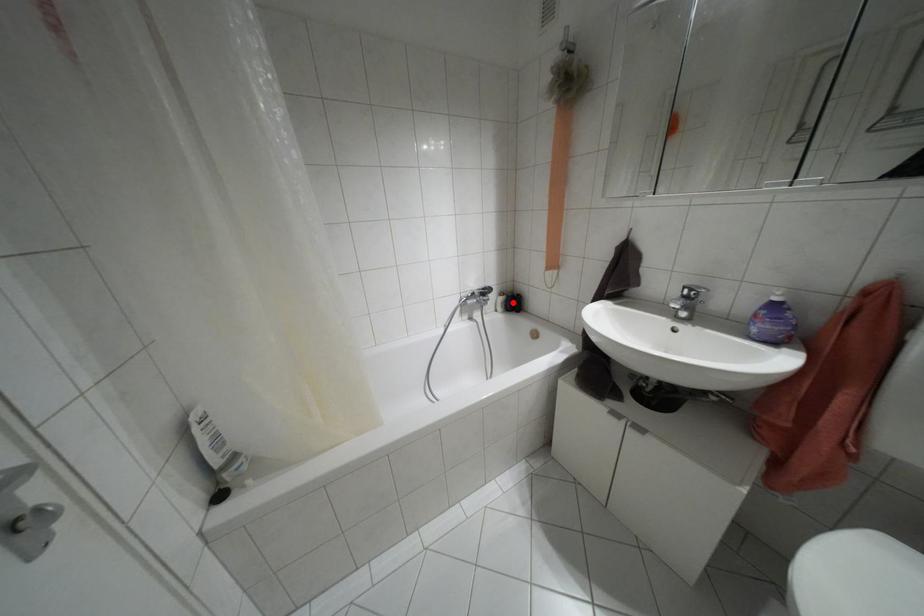
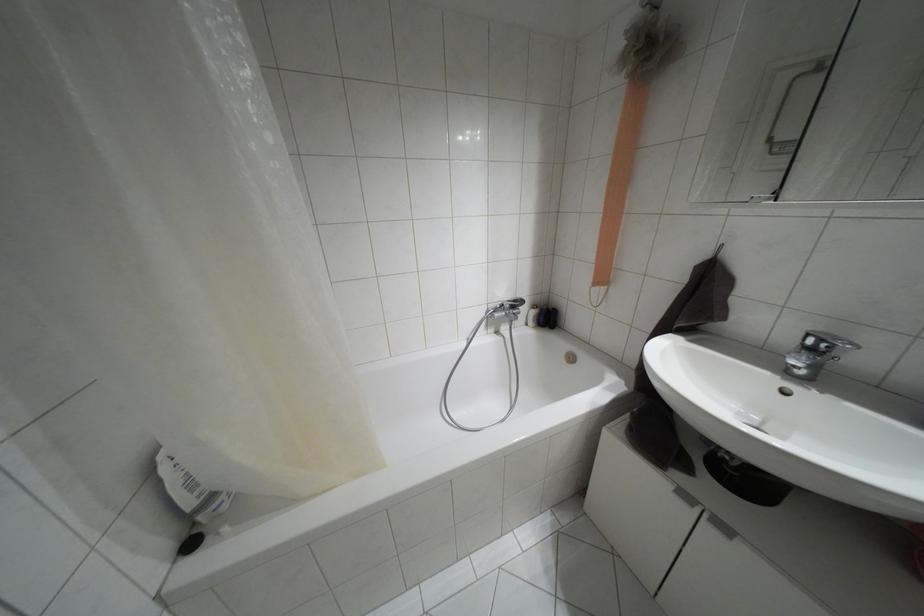
Where in the second image is the point corresponding to the highlighted location from the first image?

(546, 317)